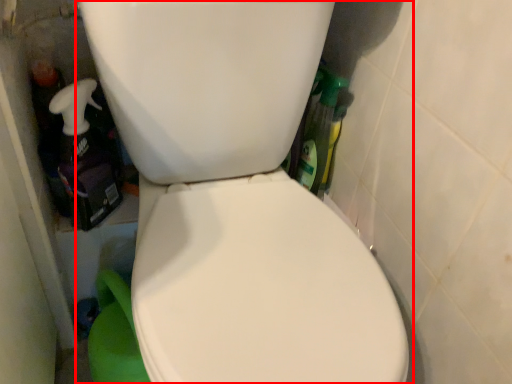
Question: In this image, where is toilet (annotated by the red box) located relative to cleaning product?

Choices:
 (A) right
 (B) left

Answer: (A)